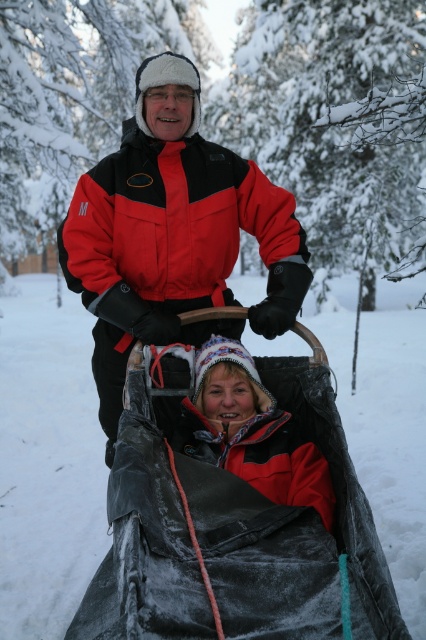
What is the exact location of the velvet black blanket at lower center in the image?

The velvet black blanket at lower center is located at point (233, 529).